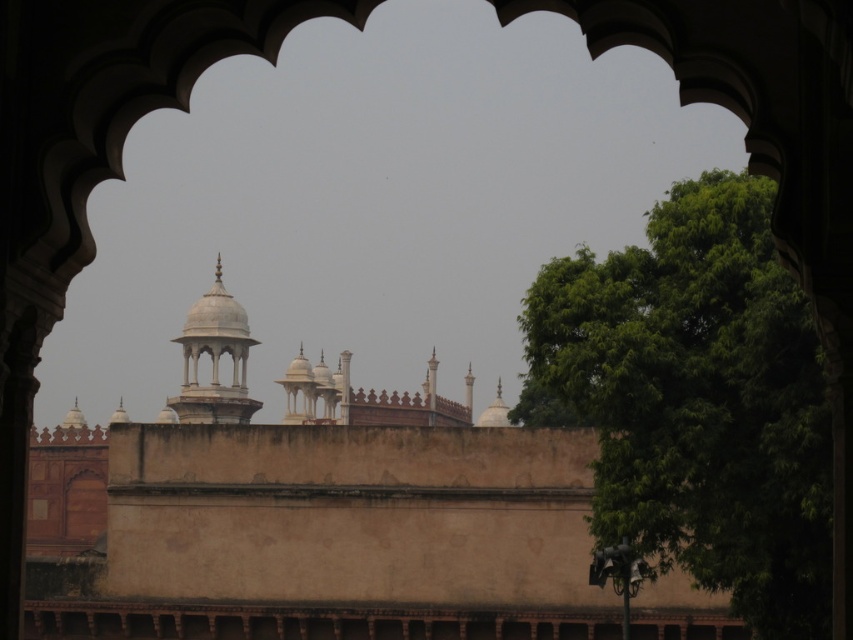
Question: Is green leafy tree at right smaller than white marble tower at center?

Choices:
 (A) yes
 (B) no

Answer: (B)

Question: Observing the image, what is the correct spatial positioning of green leafy tree at right in reference to white marble tower at center?

Choices:
 (A) left
 (B) right

Answer: (B)

Question: Which point appears closest to the camera in this image?

Choices:
 (A) (247, 333)
 (B) (648, 257)

Answer: (B)

Question: Among these objects, which one is farthest from the camera?

Choices:
 (A) green leafy tree at right
 (B) white marble tower at center

Answer: (B)

Question: Where is green leafy tree at right located in relation to white marble tower at center in the image?

Choices:
 (A) below
 (B) above

Answer: (A)

Question: Which of the following is the closest to the observer?

Choices:
 (A) (734, 228)
 (B) (215, 275)

Answer: (A)